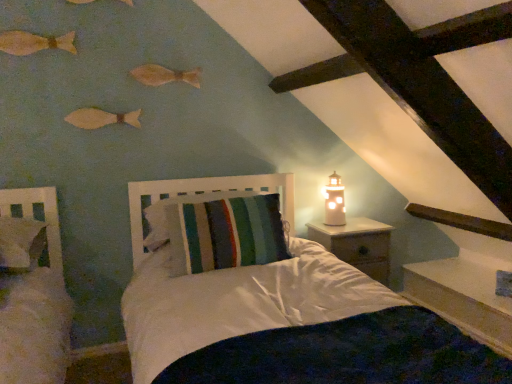
Question: Is wooden fish at upper left, marked as the first fish in a top-to-bottom arrangement, at the left side of wooden nightstand at right?

Choices:
 (A) no
 (B) yes

Answer: (B)

Question: Considering the relative sizes of wooden fish at upper left, marked as the first fish in a top-to-bottom arrangement, and wooden nightstand at right in the image provided, is wooden fish at upper left, marked as the first fish in a top-to-bottom arrangement, taller than wooden nightstand at right?

Choices:
 (A) no
 (B) yes

Answer: (A)

Question: Is wooden fish at upper left, marked as the first fish in a top-to-bottom arrangement, placed right next to wooden nightstand at right?

Choices:
 (A) yes
 (B) no

Answer: (B)

Question: Considering the relative positions of wooden fish at upper left, marked as the first fish in a top-to-bottom arrangement, and wooden nightstand at right in the image provided, is wooden fish at upper left, marked as the first fish in a top-to-bottom arrangement, to the right of wooden nightstand at right from the viewer's perspective?

Choices:
 (A) no
 (B) yes

Answer: (A)

Question: Would you say wooden fish at upper left, the 4th fish positioned from the bottom, is outside wooden nightstand at right?

Choices:
 (A) yes
 (B) no

Answer: (A)

Question: From their relative heights in the image, would you say wooden fish at upper left, the 4th fish positioned from the bottom, is taller or shorter than metallic gold lighthouse at right?

Choices:
 (A) short
 (B) tall

Answer: (A)

Question: Considering the positions of wooden fish at upper left, the 4th fish positioned from the bottom, and metallic gold lighthouse at right in the image, is wooden fish at upper left, the 4th fish positioned from the bottom, wider or thinner than metallic gold lighthouse at right?

Choices:
 (A) thin
 (B) wide

Answer: (A)

Question: Is wooden fish at upper left, the 4th fish positioned from the bottom, inside the boundaries of metallic gold lighthouse at right, or outside?

Choices:
 (A) inside
 (B) outside

Answer: (B)

Question: From a real-world perspective, is wooden fish at upper left, marked as the first fish in a top-to-bottom arrangement, physically located above or below metallic gold lighthouse at right?

Choices:
 (A) below
 (B) above

Answer: (B)

Question: Do you think wooden fish at upper left, the 4th fish positioned from the bottom, is within matte wooden fish at upper left, which ranks as the first fish in bottom-to-top order, or outside of it?

Choices:
 (A) outside
 (B) inside

Answer: (A)

Question: From a real-world perspective, relative to matte wooden fish at upper left, placed as the fourth fish when sorted from top to bottom, is wooden fish at upper left, marked as the first fish in a top-to-bottom arrangement, vertically above or below?

Choices:
 (A) below
 (B) above

Answer: (B)

Question: Would you say wooden fish at upper left, the 4th fish positioned from the bottom, is to the left or to the right of matte wooden fish at upper left, placed as the fourth fish when sorted from top to bottom, in the picture?

Choices:
 (A) left
 (B) right

Answer: (A)

Question: Is wooden fish at upper left, marked as the first fish in a top-to-bottom arrangement, taller or shorter than matte wooden fish at upper left, which ranks as the first fish in bottom-to-top order?

Choices:
 (A) short
 (B) tall

Answer: (A)

Question: Considering the positions of wooden fish at upper left, marked as the second fish in a top-to-bottom arrangement, and wooden fish at upper center, the 2th fish when ordered from bottom to top, in the image, is wooden fish at upper left, marked as the second fish in a top-to-bottom arrangement, taller or shorter than wooden fish at upper center, the 2th fish when ordered from bottom to top,?

Choices:
 (A) short
 (B) tall

Answer: (B)

Question: Considering the positions of wooden fish at upper left, marked as the second fish in a top-to-bottom arrangement, and wooden fish at upper center, the 2th fish when ordered from bottom to top, in the image, is wooden fish at upper left, marked as the second fish in a top-to-bottom arrangement, wider or thinner than wooden fish at upper center, the 2th fish when ordered from bottom to top,?

Choices:
 (A) wide
 (B) thin

Answer: (A)